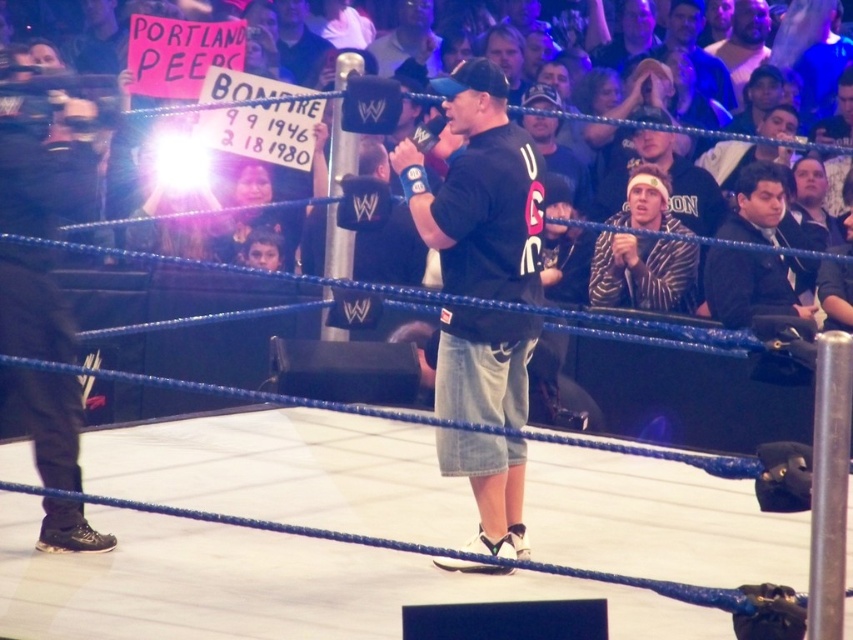
Does black denim shorts at center have a greater width compared to black suit at right?

In fact, black denim shorts at center might be narrower than black suit at right.

Who is more forward, (486, 474) or (778, 264)?

Point (486, 474) is in front.

In order to click on black denim shorts at center in this screenshot , I will do `click(479, 189)`.

In the scene shown: Is black denim shorts at center below striped hoodie at upper right?

Yes.

You are a GUI agent. You are given a task and a screenshot of the screen. Output one action in this format:
    pyautogui.click(x=<x>, y=<y>)
    Task: Click on the black denim shorts at center
    
    Given the screenshot: What is the action you would take?
    pyautogui.click(x=479, y=189)

Is point (462, 285) less distant than point (653, 193)?

Yes, point (462, 285) is closer to viewer.

You are a GUI agent. You are given a task and a screenshot of the screen. Output one action in this format:
    pyautogui.click(x=<x>, y=<y>)
    Task: Click on the black denim shorts at center
    This screenshot has width=853, height=640.
    Given the screenshot: What is the action you would take?
    pyautogui.click(x=479, y=189)

In the scene shown: Is black suit at right above striped hoodie at upper right?

No.

Who is positioned more to the right, black suit at right or striped hoodie at upper right?

black suit at right

Describe the element at coordinates (751, 285) in the screenshot. Image resolution: width=853 pixels, height=640 pixels. I see `black suit at right` at that location.

Where is `black suit at right`? This screenshot has width=853, height=640. black suit at right is located at coordinates (751, 285).